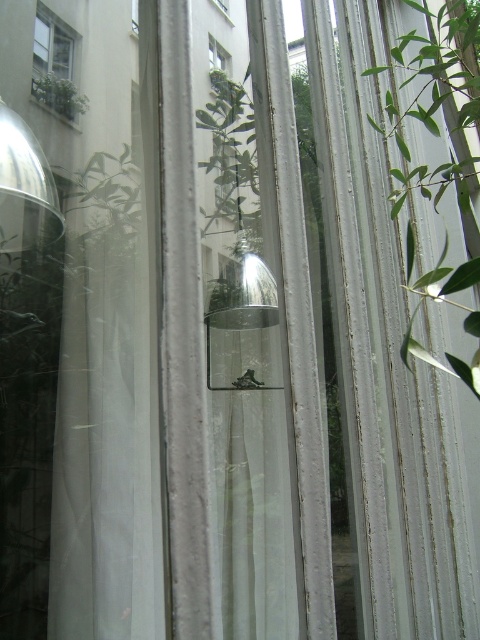
Question: Which object is farther from the camera taking this photo?

Choices:
 (A) green leafy plant at upper left
 (B) transparent glass window at center
 (C) white sheer curtain at left
 (D) white glass window sill at upper left

Answer: (B)

Question: Does green leafy plant at right have a lesser width compared to white glass window sill at upper left?

Choices:
 (A) no
 (B) yes

Answer: (A)

Question: Among these objects, which one is farthest from the camera?

Choices:
 (A) green leafy plant at right
 (B) transparent glass window at center
 (C) white sheer curtain at left

Answer: (B)

Question: Is green leafy plant at right to the right of transparent glass window at center from the viewer's perspective?

Choices:
 (A) yes
 (B) no

Answer: (A)

Question: Can you confirm if green leafy plant at right is bigger than transparent glass window at center?

Choices:
 (A) no
 (B) yes

Answer: (B)

Question: Which object is the farthest from the green leafy plant at right?

Choices:
 (A) white sheer curtain at left
 (B) transparent glass window at center

Answer: (A)